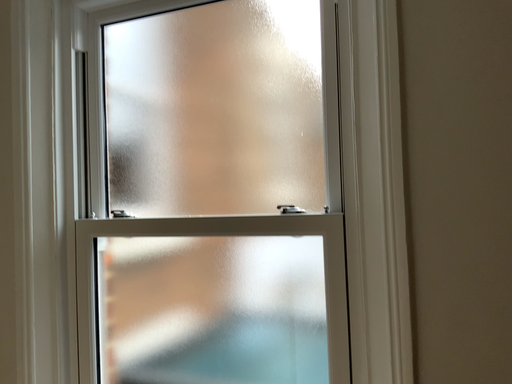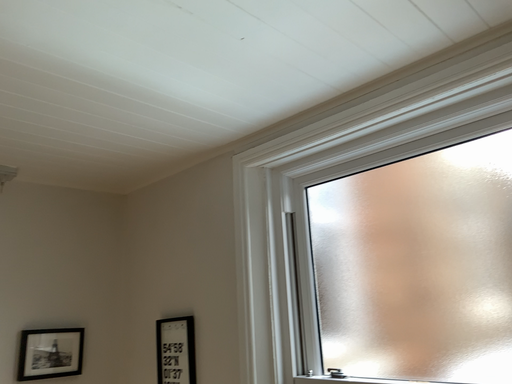
Question: Which way did the camera rotate in the video?

Choices:
 (A) rotated downward
 (B) rotated upward

Answer: (B)